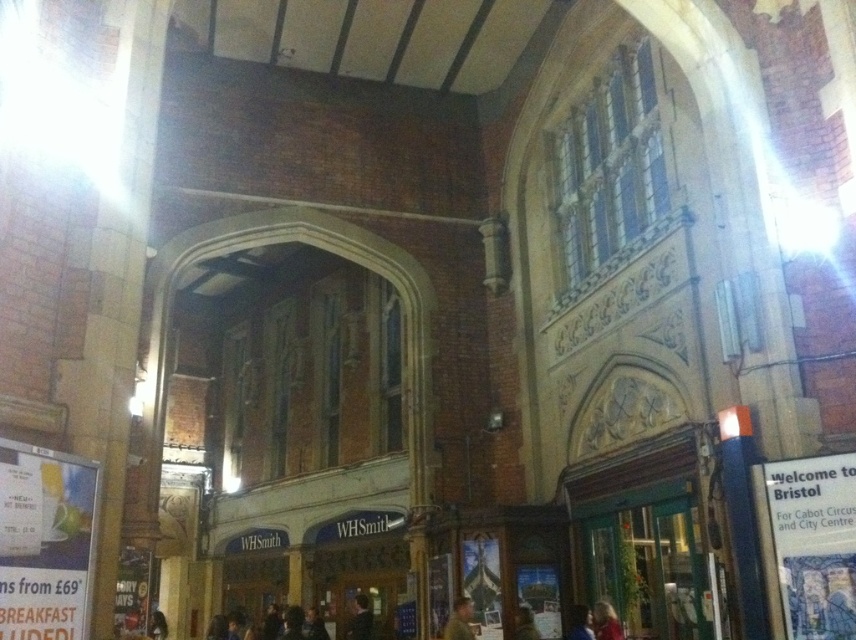
You are a photographer standing in the historic building and want to capture both the blonde hair at lower right and the blue fabric jacket at lower right in a single photo. Which object should you focus on first to ensure both are in frame?

The blonde hair at lower right is larger in size than the blue fabric jacket at lower right, so you should focus on the blonde hair at lower right first to ensure both are in frame.